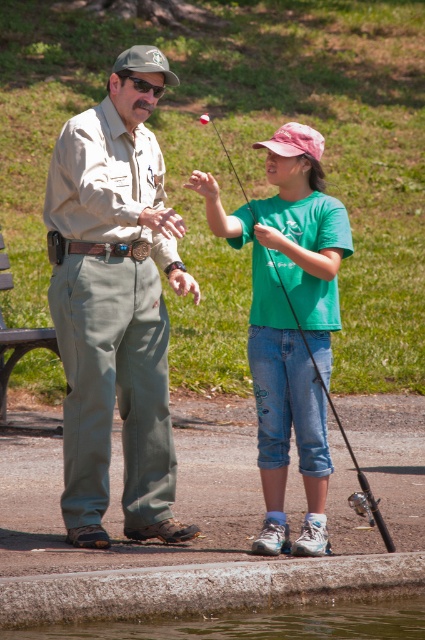
The image size is (425, 640). Describe the element at coordinates (257, 621) in the screenshot. I see `greenish water at lower center` at that location.

Can you confirm if greenish water at lower center is shorter than black plastic fishing pole at center?

Correct, greenish water at lower center is not as tall as black plastic fishing pole at center.

Image resolution: width=425 pixels, height=640 pixels. What are the coordinates of `greenish water at lower center` in the screenshot? It's located at (257, 621).

How distant is khaki uniform at center from black plastic fishing pole at center?

khaki uniform at center and black plastic fishing pole at center are 5.29 meters apart from each other.

Does khaki uniform at center have a lesser height compared to black plastic fishing pole at center?

Yes.

Find the location of a particular element. khaki uniform at center is located at coordinates (116, 304).

Locate an element on the screen. khaki uniform at center is located at coordinates (116, 304).

Is point (85, 493) closer to viewer compared to point (50, 628)?

No, (85, 493) is further to viewer.

Can you confirm if khaki uniform at center is taller than greenish water at lower center?

Correct, khaki uniform at center is much taller as greenish water at lower center.

Which is behind, point (107, 84) or point (331, 600)?

The point (107, 84) is more distant.

Identify the location of khaki uniform at center. (116, 304).